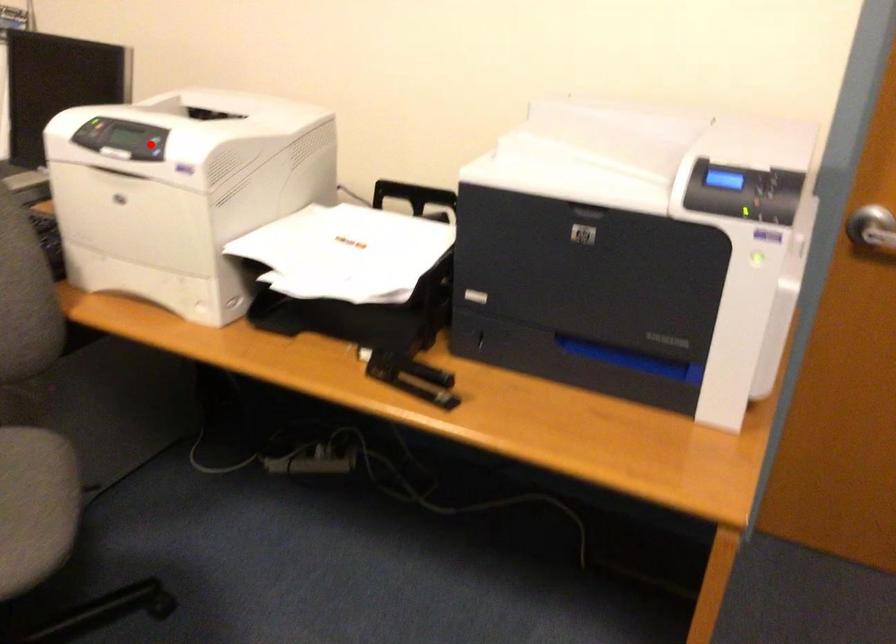
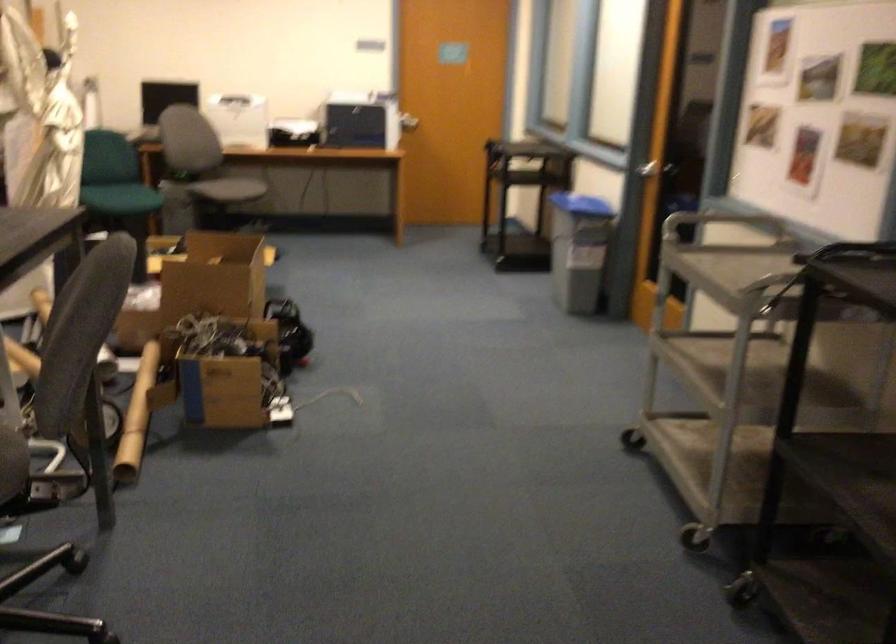
Question: I am providing you with two images of the same scene from different viewpoints. A red point is marked on the first image. Is the red point's position out of view in image 2?

Choices:
 (A) Yes
 (B) No

Answer: (A)